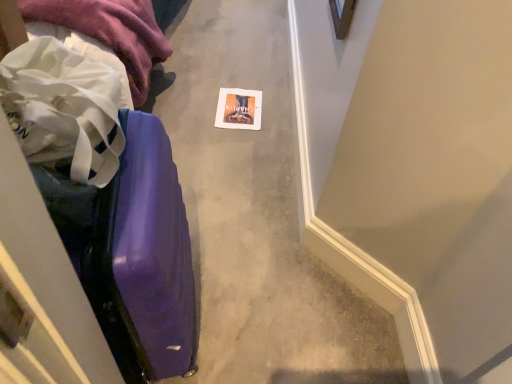
Question: From the image's perspective, is matte paper postcard at center on top of purple glossy suitcase at left?

Choices:
 (A) no
 (B) yes

Answer: (B)

Question: Could you tell me if matte paper postcard at center is turned towards purple glossy suitcase at left?

Choices:
 (A) yes
 (B) no

Answer: (B)

Question: Is matte paper postcard at center in front of purple glossy suitcase at left?

Choices:
 (A) yes
 (B) no

Answer: (B)

Question: Is matte paper postcard at center at the right side of purple glossy suitcase at left?

Choices:
 (A) no
 (B) yes

Answer: (B)

Question: From a real-world perspective, is matte paper postcard at center physically below purple glossy suitcase at left?

Choices:
 (A) no
 (B) yes

Answer: (B)

Question: Is purple glossy suitcase at left in front of or behind matte paper postcard at center in the image?

Choices:
 (A) behind
 (B) front

Answer: (B)

Question: From the image's perspective, is purple glossy suitcase at left located above or below matte paper postcard at center?

Choices:
 (A) above
 (B) below

Answer: (B)

Question: Would you say purple glossy suitcase at left is inside or outside matte paper postcard at center?

Choices:
 (A) outside
 (B) inside

Answer: (A)

Question: Is purple glossy suitcase at left to the left or to the right of matte paper postcard at center in the image?

Choices:
 (A) left
 (B) right

Answer: (A)

Question: Does point (257, 112) appear closer or farther from the camera than point (128, 61)?

Choices:
 (A) closer
 (B) farther

Answer: (B)

Question: From a real-world perspective, relative to white fabric at left, is matte paper postcard at center vertically above or below?

Choices:
 (A) below
 (B) above

Answer: (A)

Question: Relative to white fabric at left, is matte paper postcard at center in front or behind?

Choices:
 (A) behind
 (B) front

Answer: (A)

Question: Considering the positions of matte paper postcard at center and white fabric at left in the image, is matte paper postcard at center bigger or smaller than white fabric at left?

Choices:
 (A) small
 (B) big

Answer: (A)

Question: Is white fabric at left to the left or to the right of matte paper postcard at center in the image?

Choices:
 (A) left
 (B) right

Answer: (A)

Question: Is white fabric at left situated inside matte paper postcard at center or outside?

Choices:
 (A) inside
 (B) outside

Answer: (B)